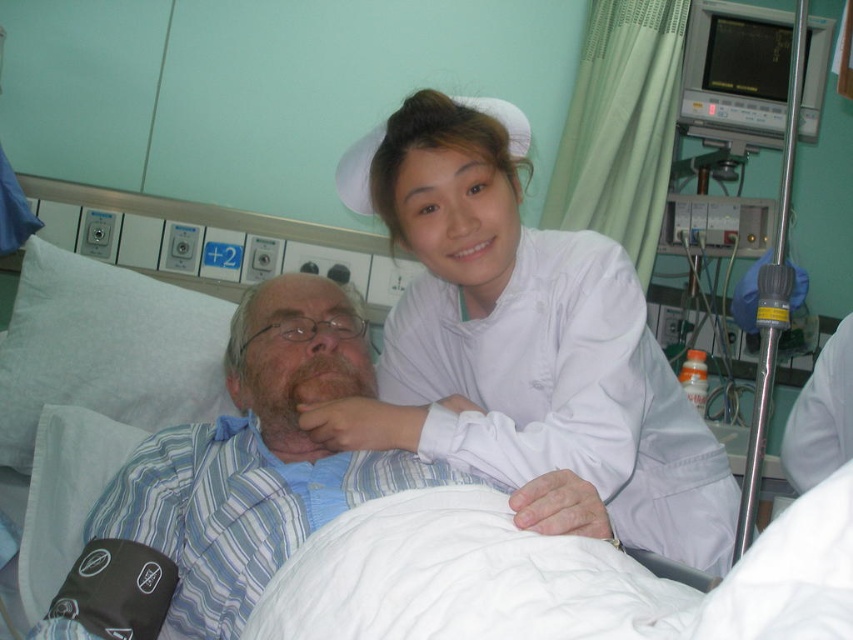
You are a nurse standing in front of a hospital bed. You need to hand a medication to the patient wearing the white cotton shirt at center. The medication is in your pocket, and you want to reach it without moving your body. Can you do this if your arm can extend 30 inches?

The white cotton shirt at center is 31.41 inches away from the camera. Since your arm can only extend 30 inches, you cannot reach the patient wearing the white cotton shirt at center without moving your body.

You are a nurse entering the hospital room and need to check the patient. Which object is closer to the ceiling, the white fabric bed at center or the white cotton shirt at center?

The white cotton shirt at center is closer to the ceiling because it is taller than the white fabric bed at center.

You are a healthcare worker entering the hospital room and need to check the distance between the white smooth nurse cap at upper center and the white smooth uniform at upper center to ensure proper fitting of a new uniform. Can a 14 inch wide accessory fit between them?

The distance between the white smooth nurse cap at upper center and the white smooth uniform at upper center is 14.54 inches, so a 14 inch wide accessory can fit between them since it is narrower than the space available.